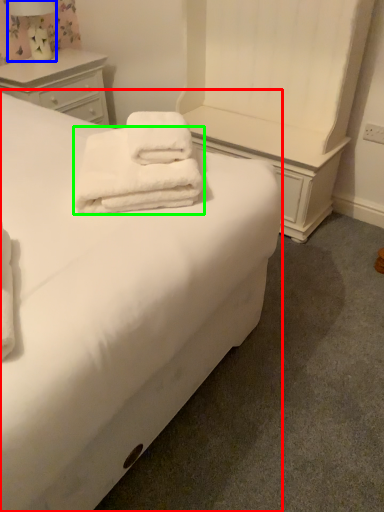
Question: Estimate the real-world distances between objects in this image. Which object is closer to bed (highlighted by a red box), bedside lamp (highlighted by a blue box) or towel (highlighted by a green box)?

Choices:
 (A) bedside lamp
 (B) towel

Answer: (B)